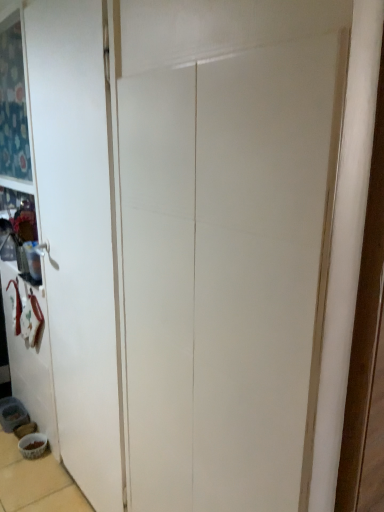
The image size is (384, 512). In order to click on free space in front of white glossy bowl at lower left in this screenshot , I will do `click(31, 472)`.